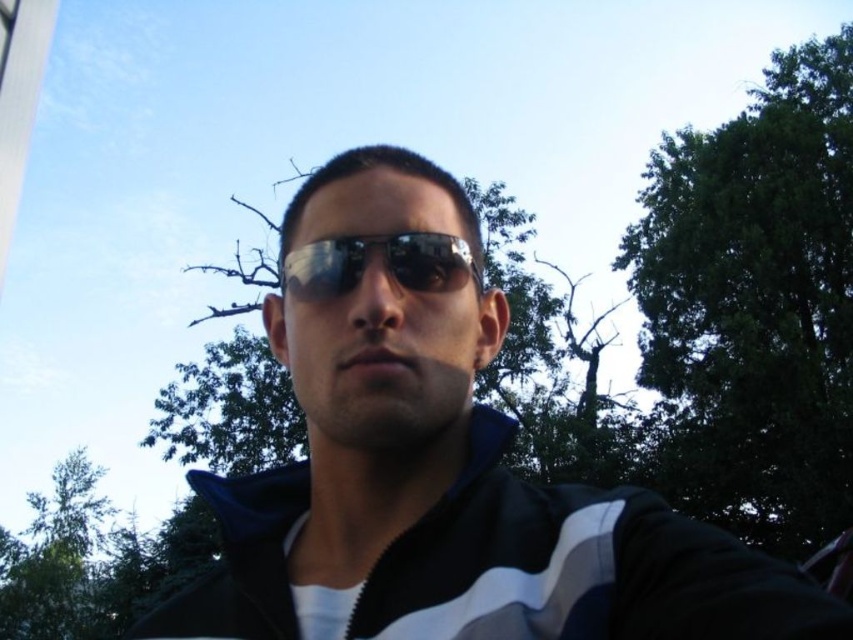
You are a photographer trying to capture the subject in the image. The subject is wearing black matte sunglasses at center. If you want to focus on the point at coordinates point (451, 508), where exactly would that be located on the subject?

The point (451, 508) is located on the black matte sunglasses at center.